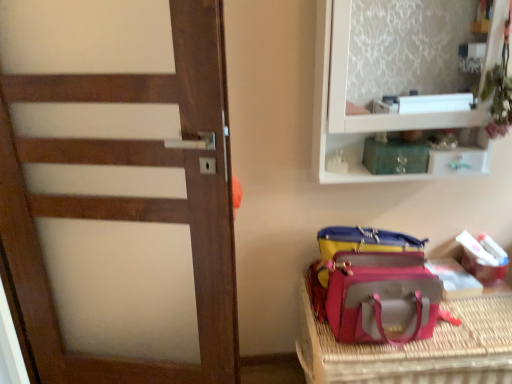
I want to click on wooden door at left, so click(132, 198).

The image size is (512, 384). What do you see at coordinates (395, 156) in the screenshot?
I see `green glass jar at upper center, the 1th kit positioned from the left` at bounding box center [395, 156].

At what (x,y) coordinates should I click in order to perform the action: click on white glossy cabinet at upper right. Please return your answer as a coordinate pair (x, y). This screenshot has width=512, height=384. Looking at the image, I should click on (366, 114).

Image resolution: width=512 pixels, height=384 pixels. Identify the location of pink fabric bag at lower right. point(378,297).

Identify the location of wooden door at left. (132, 198).

Identify the location of furniture below the pink fabric bag at lower right (from a real-world perspective). (415, 347).

Looking at this image, which point is more forward, (426, 377) or (351, 317)?

The point (351, 317) is closer to the camera.

Is leatherette pet carrier at lower right oriented away from pink fabric bag at lower right?

No, pink fabric bag at lower right is not at the back of leatherette pet carrier at lower right.

Would you consider leatherette pet carrier at lower right to be distant from pink fabric bag at lower right?

leatherette pet carrier at lower right is actually quite close to pink fabric bag at lower right.

From a real-world perspective, which is physically above, white cardboard box at lower right, which appears as the 1th kit when viewed from the back, or green glass jar at upper center, the 1th kit positioned from the left?

green glass jar at upper center, the 1th kit positioned from the left, is physically above.

Identify the location of kit in front of the white cardboard box at lower right, marked as the second kit in a front-to-back arrangement. (395, 156).

Relative to green glass jar at upper center, arranged as the second kit when ordered from the bottom, is white cardboard box at lower right, the first kit when ordered from bottom to top, in front or behind?

white cardboard box at lower right, the first kit when ordered from bottom to top, is behind green glass jar at upper center, arranged as the second kit when ordered from the bottom.

Considering the relative sizes of white cardboard box at lower right, marked as the second kit in a front-to-back arrangement, and green glass jar at upper center, the 1th kit in the top-to-bottom sequence, in the image provided, is white cardboard box at lower right, marked as the second kit in a front-to-back arrangement, taller than green glass jar at upper center, the 1th kit in the top-to-bottom sequence,?

No.

Find the location of `the 1st kit above when counting from the leatherette pet carrier at lower right (from the image's perspective)`. the 1st kit above when counting from the leatherette pet carrier at lower right (from the image's perspective) is located at coordinates (483, 257).

Is white cardboard box at lower right, marked as the 2th kit in a top-to-bottom arrangement, turned away from leatherette pet carrier at lower right?

No, white cardboard box at lower right, marked as the 2th kit in a top-to-bottom arrangement, is not facing the opposite direction of leatherette pet carrier at lower right.

Considering the points (506, 260) and (468, 306), which point is behind, point (506, 260) or point (468, 306)?

Positioned behind is point (506, 260).

Can you confirm if white cardboard box at lower right, which is the 1th kit in right-to-left order, is shorter than leatherette pet carrier at lower right?

Yes, white cardboard box at lower right, which is the 1th kit in right-to-left order, is shorter than leatherette pet carrier at lower right.

Is leatherette pet carrier at lower right situated inside green glass jar at upper center, the second kit in the back-to-front sequence, or outside?

leatherette pet carrier at lower right cannot be found inside green glass jar at upper center, the second kit in the back-to-front sequence.

How different are the orientations of leatherette pet carrier at lower right and green glass jar at upper center, arranged as the second kit when ordered from the bottom, in degrees?

1.17 degrees.

From a real-world perspective, which is physically below, leatherette pet carrier at lower right or green glass jar at upper center, the second kit in the back-to-front sequence?

leatherette pet carrier at lower right is physically lower.

From the picture: From a real-world perspective, which object rests below the other?

leatherette pet carrier at lower right.

In the scene shown: Between leatherette pet carrier at lower right and metallic green drawer at upper right, which one has smaller size?

metallic green drawer at upper right is smaller.

Is leatherette pet carrier at lower right looking in the opposite direction of metallic green drawer at upper right?

No, leatherette pet carrier at lower right is not facing away from metallic green drawer at upper right.

Considering the sizes of pink fabric bag at lower right and wooden door at left in the image, is pink fabric bag at lower right bigger or smaller than wooden door at left?

Clearly, pink fabric bag at lower right is smaller in size than wooden door at left.

From the image's perspective, is pink fabric bag at lower right under wooden door at left?

Yes, from the image's perspective, pink fabric bag at lower right is beneath wooden door at left.

From a real-world perspective, which object stands above the other?

In real-world perspective, wooden door at left is above.

Does wooden door at left turn towards white cardboard box at lower right, which is the 1th kit in right-to-left order?

No, wooden door at left is not turned towards white cardboard box at lower right, which is the 1th kit in right-to-left order.

Is wooden door at left outside of white cardboard box at lower right, marked as the second kit in a front-to-back arrangement?

Yes, wooden door at left is outside of white cardboard box at lower right, marked as the second kit in a front-to-back arrangement.

At what (x,y) coordinates should I click in order to perform the action: click on luggage and bags located in front of the leatherette pet carrier at lower right. Please return your answer as a coordinate pair (x, y). The image size is (512, 384). Looking at the image, I should click on [378, 297].

Where is `kit behind the green glass jar at upper center, the 1th kit from the front`? This screenshot has width=512, height=384. kit behind the green glass jar at upper center, the 1th kit from the front is located at coordinates (483, 257).

In the scene shown: Considering their positions, is white glossy cabinet at upper right positioned further to metallic green drawer at upper right than pink fabric bag at lower right?

pink fabric bag at lower right.

Considering their positions, is green glass jar at upper center, the 1th kit from the front, positioned closer to white glossy cabinet at upper right than white cardboard box at lower right, which is the 1th kit in right-to-left order?

green glass jar at upper center, the 1th kit from the front, is closer to white glossy cabinet at upper right.

Which object lies nearer to the anchor point leatherette pet carrier at lower right, green glass jar at upper center, the 1th kit in the top-to-bottom sequence, or pink fabric bag at lower right?

pink fabric bag at lower right is closer to leatherette pet carrier at lower right.

From the image, which object appears to be farther from metallic green drawer at upper right, white glossy cabinet at upper right or wooden door at left?

wooden door at left lies further to metallic green drawer at upper right than the other object.

Estimate the real-world distances between objects in this image. Which object is further from pink fabric bag at lower right, white cardboard box at lower right, marked as the second kit in a front-to-back arrangement, or wooden door at left?

wooden door at left lies further to pink fabric bag at lower right than the other object.

From the image, which object appears to be nearer to leatherette pet carrier at lower right, white cardboard box at lower right, which appears as the second kit when viewed from the left, or metallic green drawer at upper right?

white cardboard box at lower right, which appears as the second kit when viewed from the left.

When comparing their distances from green glass jar at upper center, the 2th kit when ordered from right to left, does white cardboard box at lower right, marked as the 2th kit in a top-to-bottom arrangement, or pink fabric bag at lower right seem further?

white cardboard box at lower right, marked as the 2th kit in a top-to-bottom arrangement, is positioned further to the anchor green glass jar at upper center, the 2th kit when ordered from right to left.

Which object lies nearer to the anchor point leatherette pet carrier at lower right, white glossy cabinet at upper right or white cardboard box at lower right, which appears as the 1th kit when viewed from the back?

white cardboard box at lower right, which appears as the 1th kit when viewed from the back, is closer to leatherette pet carrier at lower right.

Locate an element on the screen. kit situated between wooden door at left and white cardboard box at lower right, marked as the second kit in a front-to-back arrangement, from left to right is located at coordinates (395, 156).

The image size is (512, 384). Identify the location of luggage and bags between wooden door at left and green glass jar at upper center, the second kit in the back-to-front sequence, in the horizontal direction. (378, 297).

Find the location of a particular element. luggage and bags located between wooden door at left and metallic green drawer at upper right in the left-right direction is located at coordinates (378, 297).

You are a GUI agent. You are given a task and a screenshot of the screen. Output one action in this format:
    pyautogui.click(x=<x>, y=<y>)
    Task: Click on the drawer between green glass jar at upper center, the 1th kit from the front, and white cardboard box at lower right, the first kit when ordered from bottom to top, in the up-down direction
    Image resolution: width=512 pixels, height=384 pixels.
    Given the screenshot: What is the action you would take?
    pyautogui.click(x=457, y=161)